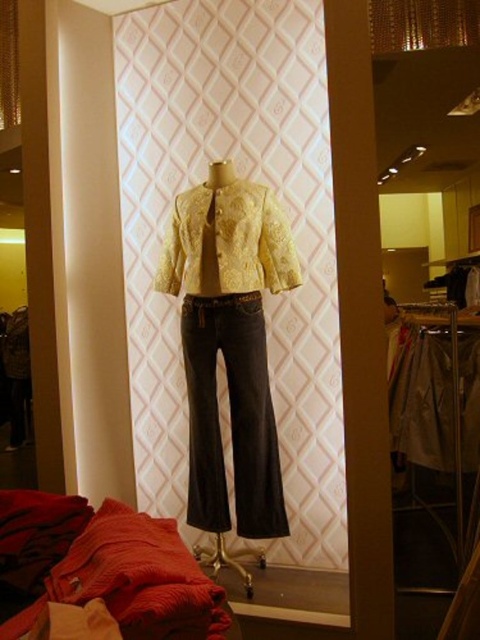
You are a fashion designer trying to place a decorative pin on the outfit of the mannequin. The pin needs to be placed exactly at the coordinates point (230, 417). Based on the image description, which part of the outfit will the pin be attached to?

The point (230, 417) is located on the dark gray denim jeans at center, so the pin will be attached to the dark gray denim jeans at center.

You are a fashion designer trying to fit a new outfit onto a mannequin. The outfit includes the dark gray denim jeans at center and the white cotton shirt at center. Which piece of clothing takes up more space on the mannequin?

The white cotton shirt at center takes up more space on the mannequin than the dark gray denim jeans at center because the jeans occupy less space according to the description.